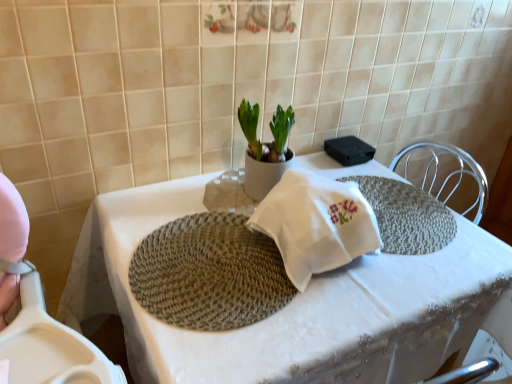
Where is `blank space situated above white woven placemat at center (from a real-world perspective)`? The height and width of the screenshot is (384, 512). blank space situated above white woven placemat at center (from a real-world perspective) is located at coordinates click(x=298, y=284).